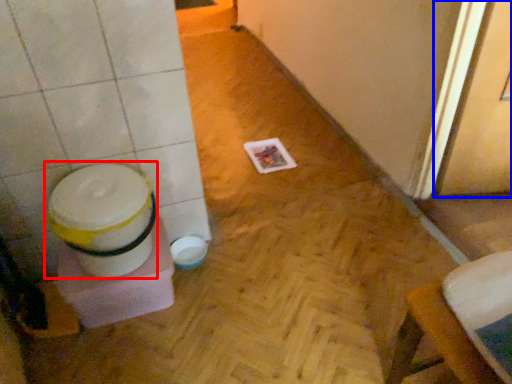
Question: Which point is closer to the camera, potty (highlighted by a red box) or screen door (highlighted by a blue box)?

Choices:
 (A) potty
 (B) screen door

Answer: (B)